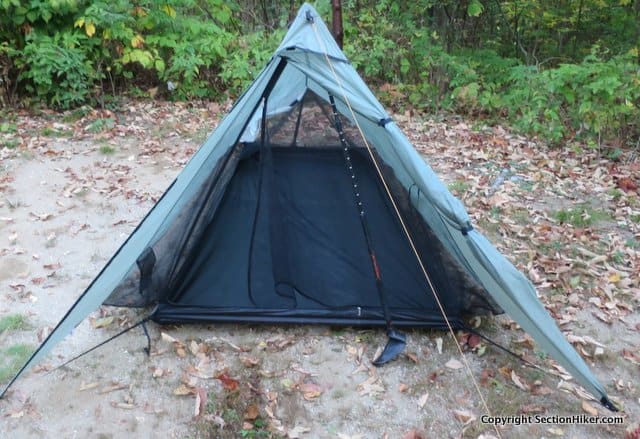
At what (x,y) coordinates should I click in order to perform the action: click on floor of the tent. Please return your answer as a coordinate pair (x, y). Looking at the image, I should click on (310, 224).